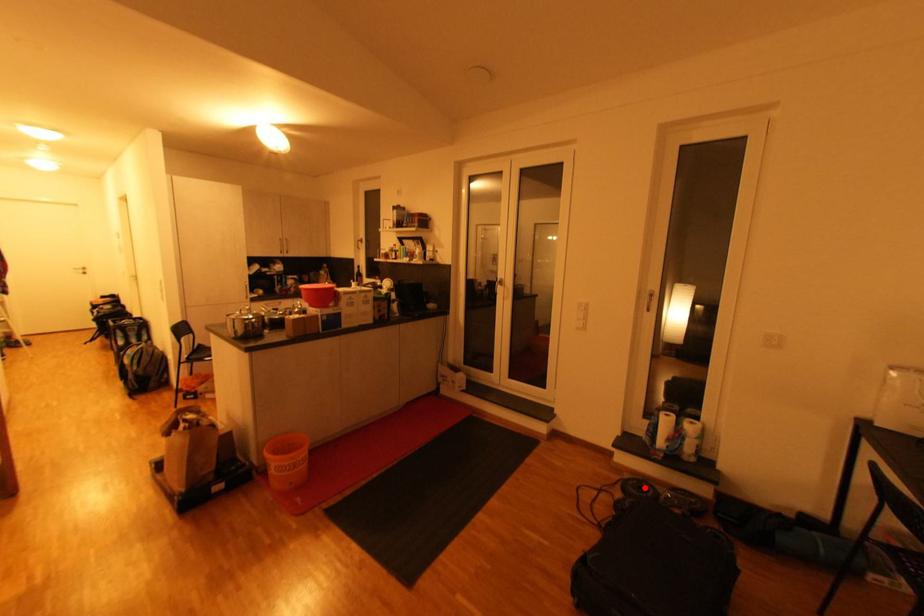
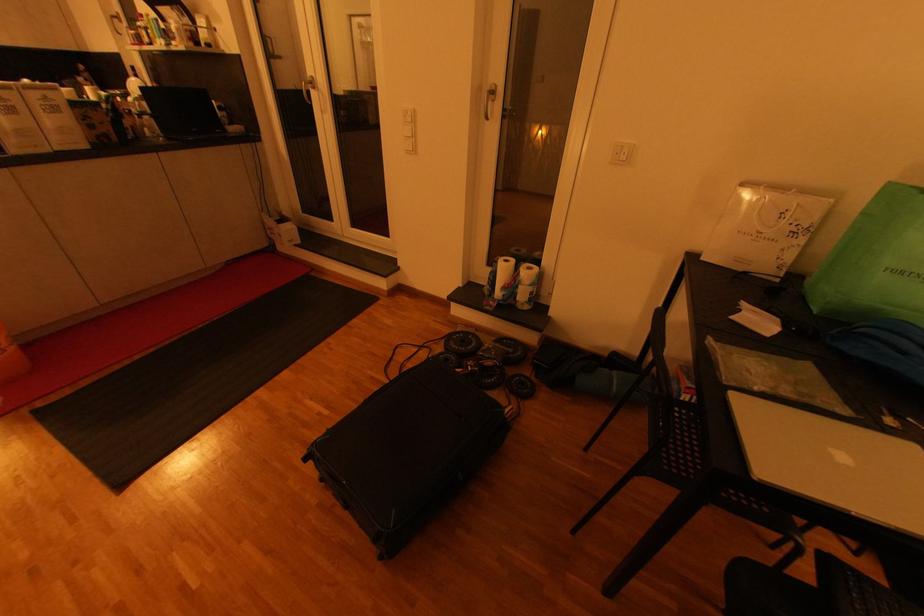
Question: A red point is marked in image1. In image2, is the corresponding 3D point closer to the camera or farther? Reply with the corresponding letter.

Choices:
 (A) The corresponding 3D point is closer.
 (B) The corresponding 3D point is farther.

Answer: (B)